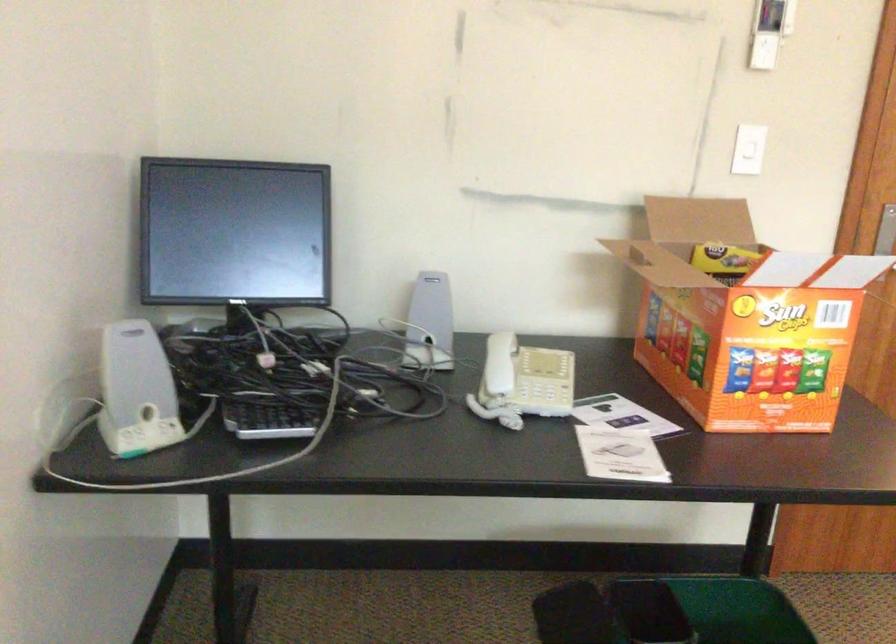
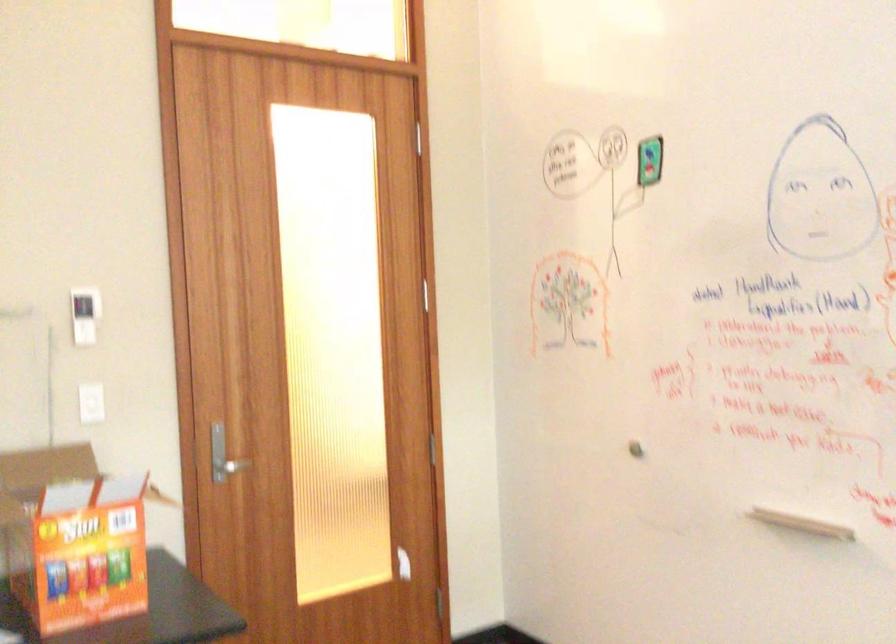
Locate, in the second image, the point that corresponds to point 764,327 in the first image.

(72, 538)